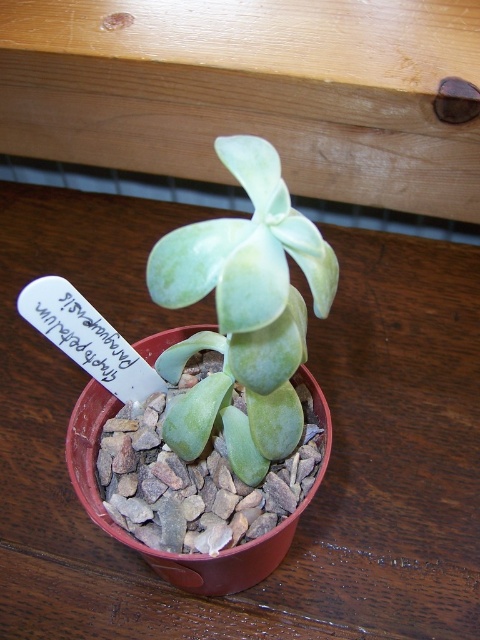
You are looking at the red plastic pot with the green succulent at center and gray gravel at center. Which object is closer to you?

The green succulent at center is closer to the viewer than the gray gravel at center.

Based on the scene described, which object is taller between the green succulent at center and the gray gravel at center?

The green succulent at center is taller than the gray gravel at center according to the description.

You are standing in front of the red plastic pot with the white label. There is a point marked at coordinates (245, 308). Which object is this point located on?

The point marked at coordinates (245, 308) is located on the green succulent at center.